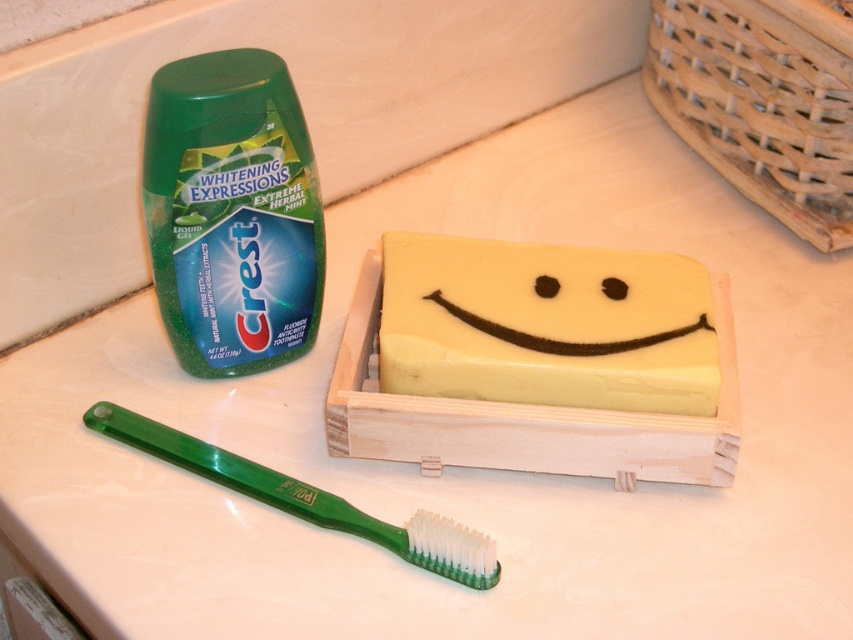
Question: Which point is closer to the camera taking this photo?

Choices:
 (A) (103, 419)
 (B) (280, 241)

Answer: (A)

Question: Is green glossy toothpaste tube at upper left above green plastic toothbrush at lower left?

Choices:
 (A) yes
 (B) no

Answer: (A)

Question: Does yellow translucent soap at center have a smaller size compared to green glossy toothpaste tube at upper left?

Choices:
 (A) no
 (B) yes

Answer: (B)

Question: Estimate the real-world distances between objects in this image. Which object is closer to the green plastic toothbrush at lower left?

Choices:
 (A) yellow translucent soap at center
 (B) green glossy toothpaste tube at upper left

Answer: (B)

Question: Based on their relative distances, which object is nearer to the yellow translucent soap at center?

Choices:
 (A) green glossy toothpaste tube at upper left
 (B) green plastic toothbrush at lower left

Answer: (A)

Question: Does yellow translucent soap at center appear over green plastic toothbrush at lower left?

Choices:
 (A) yes
 (B) no

Answer: (A)